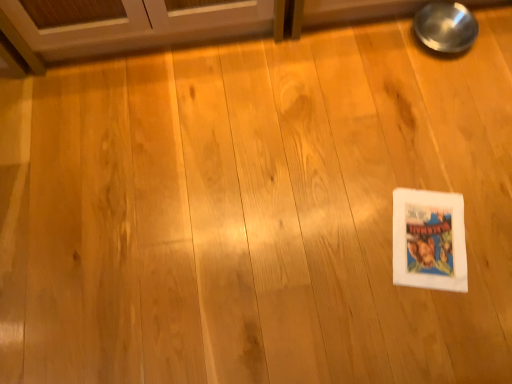
Question: From a real-world perspective, is white paper comic book at lower right physically located above or below metallic reflective bowl at upper right?

Choices:
 (A) below
 (B) above

Answer: (A)

Question: Based on their positions, is white paper comic book at lower right located to the left or right of metallic reflective bowl at upper right?

Choices:
 (A) left
 (B) right

Answer: (A)

Question: In the image, is white paper comic book at lower right positioned in front of or behind metallic reflective bowl at upper right?

Choices:
 (A) front
 (B) behind

Answer: (A)

Question: In terms of width, does metallic reflective bowl at upper right look wider or thinner when compared to white paper comic book at lower right?

Choices:
 (A) wide
 (B) thin

Answer: (B)

Question: Is metallic reflective bowl at upper right in front of or behind white paper comic book at lower right in the image?

Choices:
 (A) behind
 (B) front

Answer: (A)

Question: From the image's perspective, is metallic reflective bowl at upper right located above or below white paper comic book at lower right?

Choices:
 (A) above
 (B) below

Answer: (A)

Question: In terms of size, does metallic reflective bowl at upper right appear bigger or smaller than white paper comic book at lower right?

Choices:
 (A) big
 (B) small

Answer: (A)